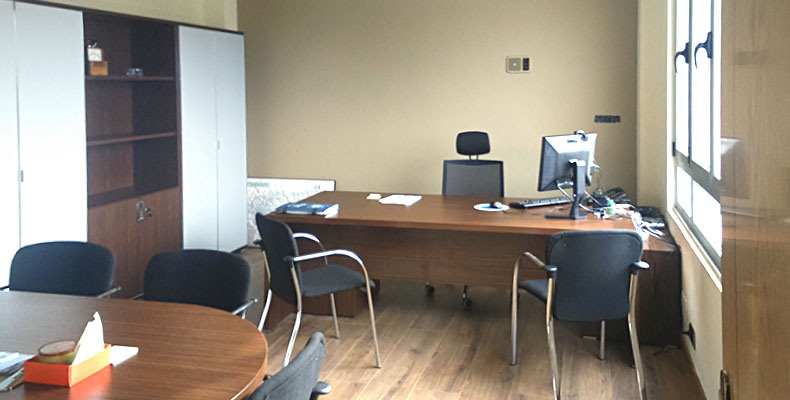
In order to click on shelf in this screenshot , I will do `click(122, 140)`, `click(118, 78)`.